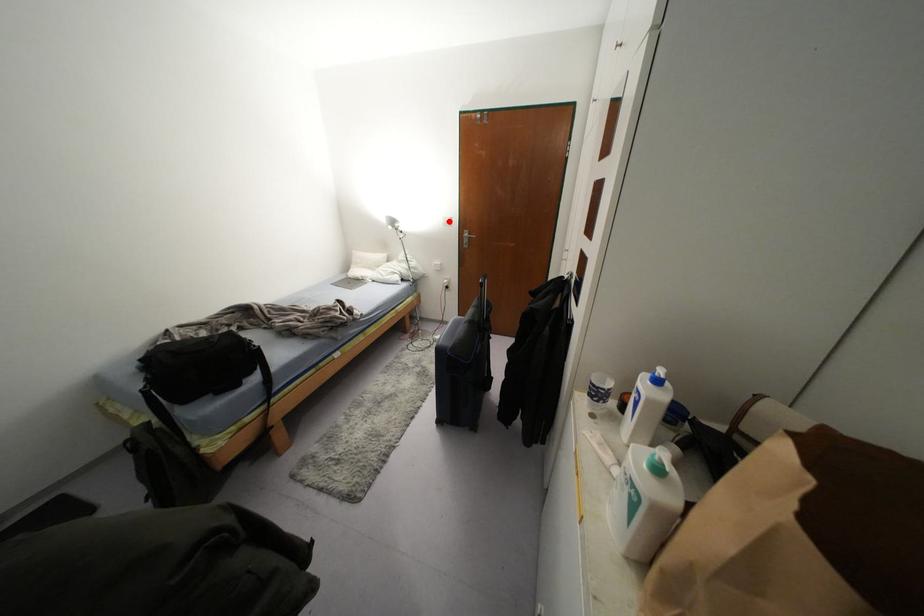
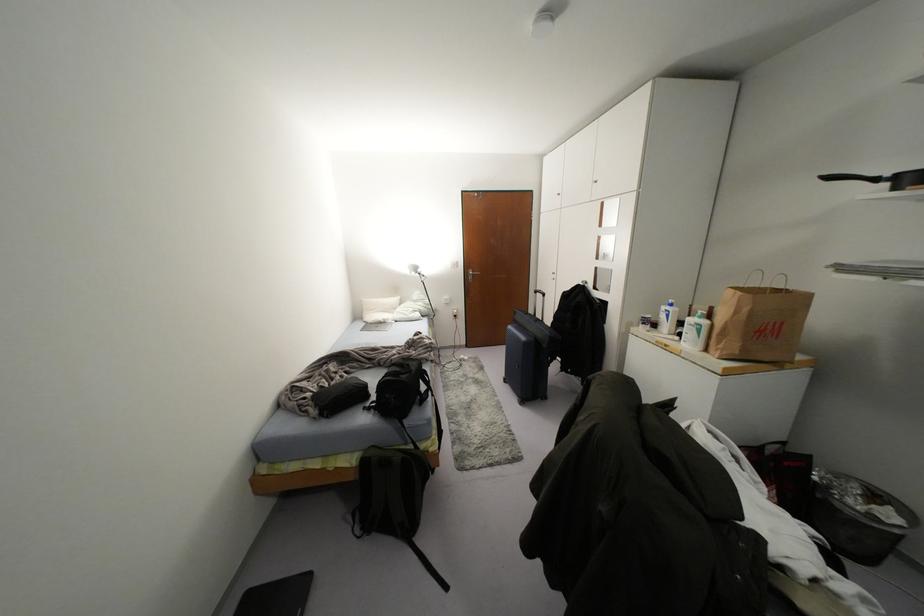
Question: A red point is marked in image1. In image2, is the corresponding 3D point closer to the camera or farther? Reply with the corresponding letter.

Choices:
 (A) The corresponding 3D point is closer.
 (B) The corresponding 3D point is farther.

Answer: (B)